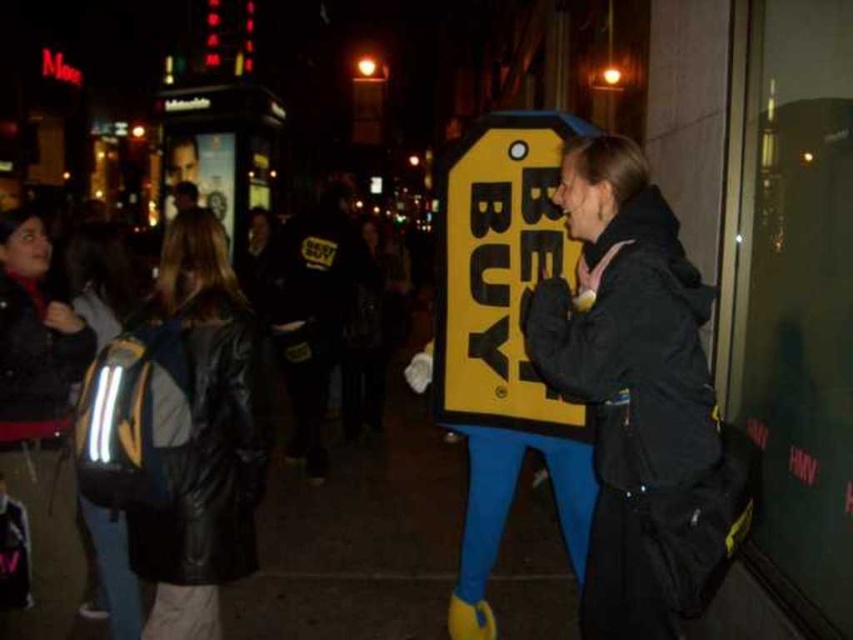
Between point (573, 166) and point (490, 420), which one is positioned behind?

The point (490, 420) is behind.

Identify the location of black matte jacket at center. (627, 376).

Find the location of a particular element. Image resolution: width=853 pixels, height=640 pixels. black matte jacket at center is located at coordinates (627, 376).

What do you see at coordinates (627, 376) in the screenshot? I see `black matte jacket at center` at bounding box center [627, 376].

The image size is (853, 640). Identify the location of black matte jacket at center. (627, 376).

Find the location of a particular element. black leather jacket at center is located at coordinates (202, 433).

What do you see at coordinates (202, 433) in the screenshot? I see `black leather jacket at center` at bounding box center [202, 433].

What do you see at coordinates (202, 433) in the screenshot?
I see `black leather jacket at center` at bounding box center [202, 433].

Find the location of `black leather jacket at center`. black leather jacket at center is located at coordinates pyautogui.click(x=202, y=433).